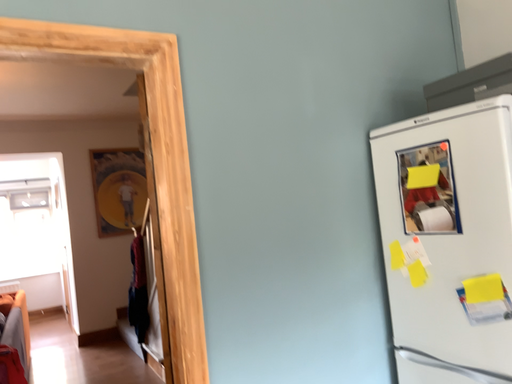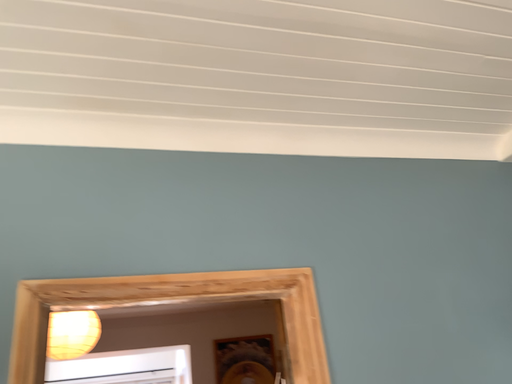
Question: Which way did the camera rotate in the video?

Choices:
 (A) rotated upward
 (B) rotated downward

Answer: (A)